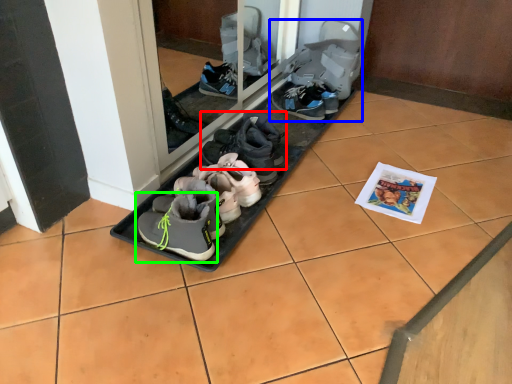
Question: Which is farther away from footwear (highlighted by a red box)? footwear (highlighted by a blue box) or footwear (highlighted by a green box)?

Choices:
 (A) footwear
 (B) footwear

Answer: (A)